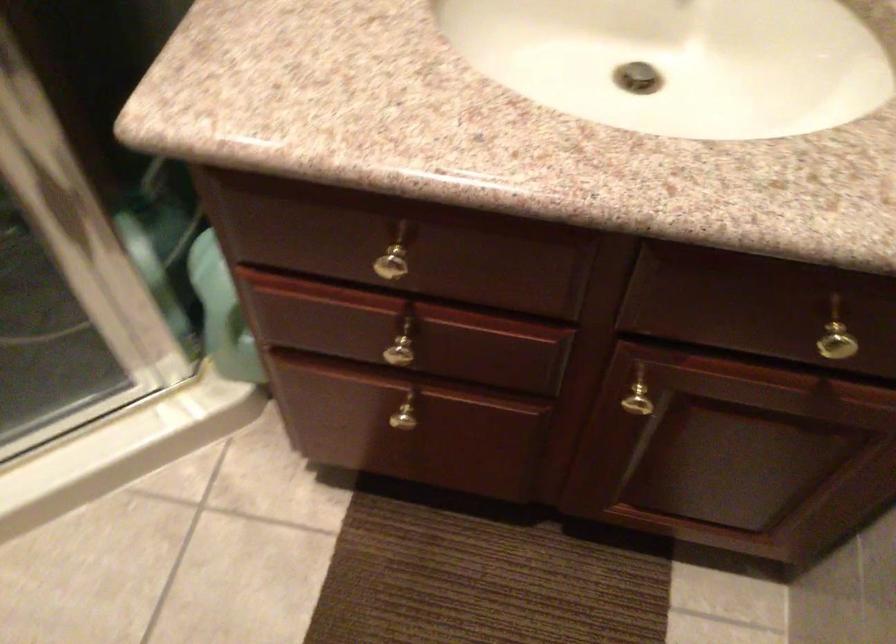
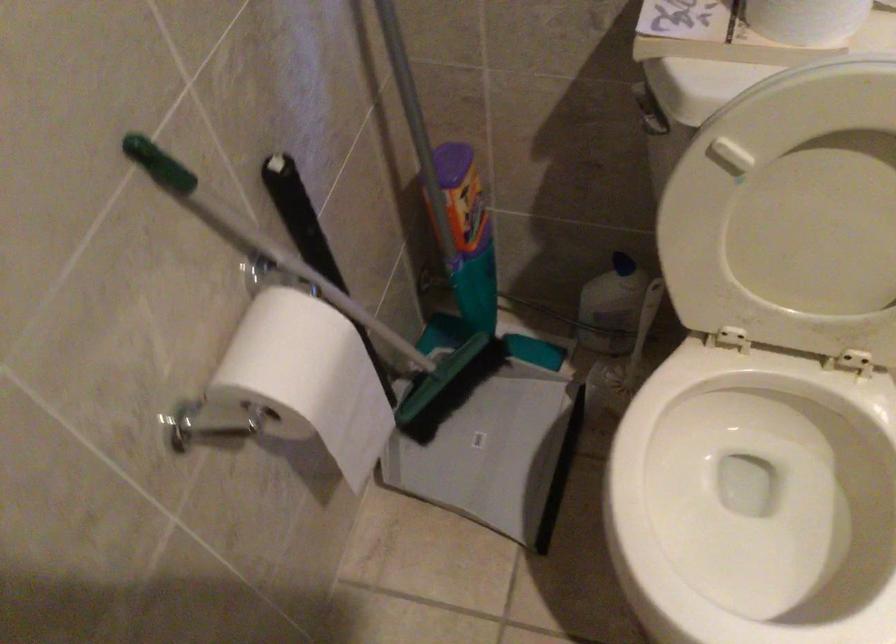
The images are taken continuously from a first-person perspective. In which direction is your viewpoint rotating?

Result: The camera rotated toward left-down.